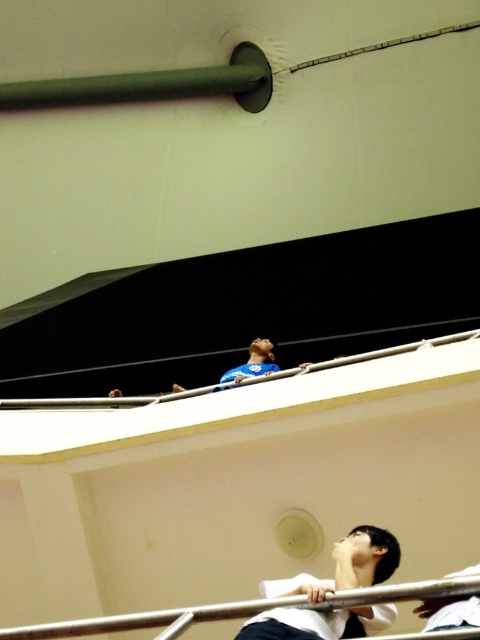
You are standing on the balcony and want to reach the green matte pole at upper left located at point (152, 84). Considering your current position, which direction should you move to get closer to it?

The green matte pole at upper left is located at point (152, 84), so you should move towards the upper left direction to get closer to it.

You are an interior designer assessing the space for safety. You notice the green matte pole at upper left and the black matte shirt at lower center. Which object is larger in size?

The green matte pole at upper left is bigger than the black matte shirt at lower center according to the description.